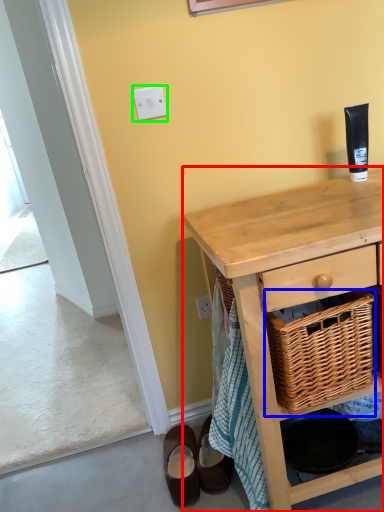
Question: Which object is positioned closest to desk (highlighted by a red box)? Select from picnic basket (highlighted by a blue box) and light switch (highlighted by a green box).

Choices:
 (A) picnic basket
 (B) light switch

Answer: (A)